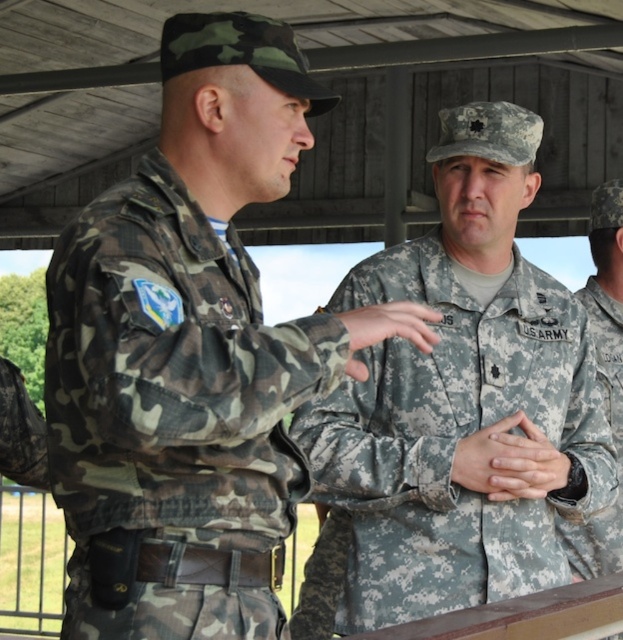
You are a military observer trying to identify the ranks of the soldiers based on their uniforms. According to the scene, which of the two soldiers wearing camo fabric uniform at center and camouflage fabric uniform at right has a higher rank?

The camo fabric uniform at center is larger in size than camouflage fabric uniform at right, which might indicate a higher rank as larger uniforms could signify seniority in some military contexts.

You are a photographer trying to capture a photo of the camouflage fabric uniform at center and the camouflage fabric uniform at right. Since you want them both to be in the frame, which one should you position your camera closer to?

You should position your camera closer to the camouflage fabric uniform at right because the camouflage fabric uniform at center is positioned on the left side of camouflage fabric uniform at right, meaning the camouflage fabric uniform at right is further away from the camera.

What are the coordinates of the camo fabric uniform at center?

The camo fabric uniform at center is located at coordinates point (174,412).